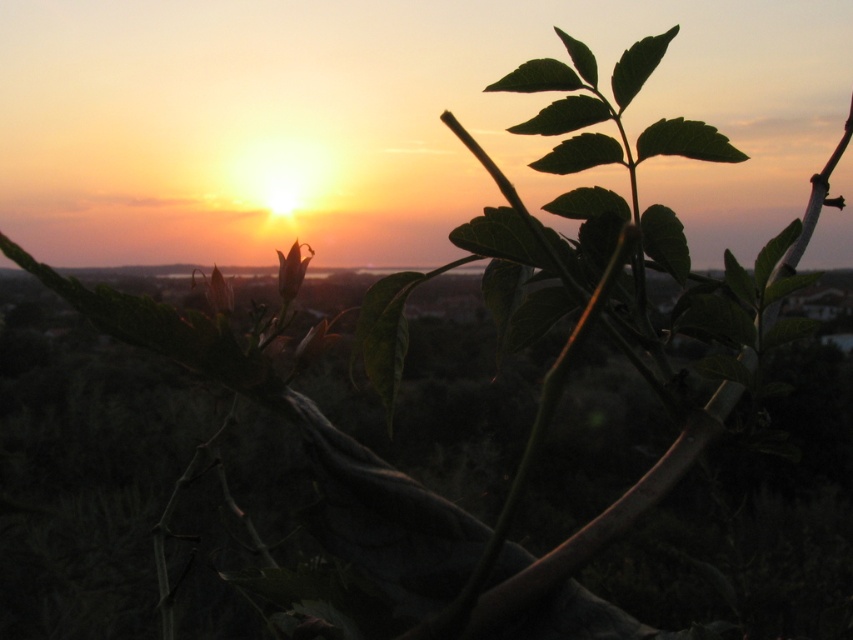
Looking at this image, you are an artist painting the sunset scene and want to ensure the flowers are accurately depicted. Which flower is taller, the translucent orange flower at center or the green matte flower at center?

The green matte flower at center is taller than the translucent orange flower at center.

You are holding a camera and want to capture a closeup shot of the translucent orange flower at center. The camera requires the subject to be at least 24 inches away to focus properly. Based on the scene, will the flower be in focus?

The translucent orange flower at center is only 22.05 inches away from the camera, which is less than the required 24 inches. Therefore, the flower will not be in focus.

You are an artist trying to paint the sunset scene. You want to place a translucent orange flower at the exact center of your canvas. Is the translucent orange flower at center already positioned correctly?

The translucent orange flower at center is located at point (292, 269), which is not exactly the center of the canvas. The exact center would be at coordinates (426, 320). Therefore, the flower is slightly to the left and lower than the true center.